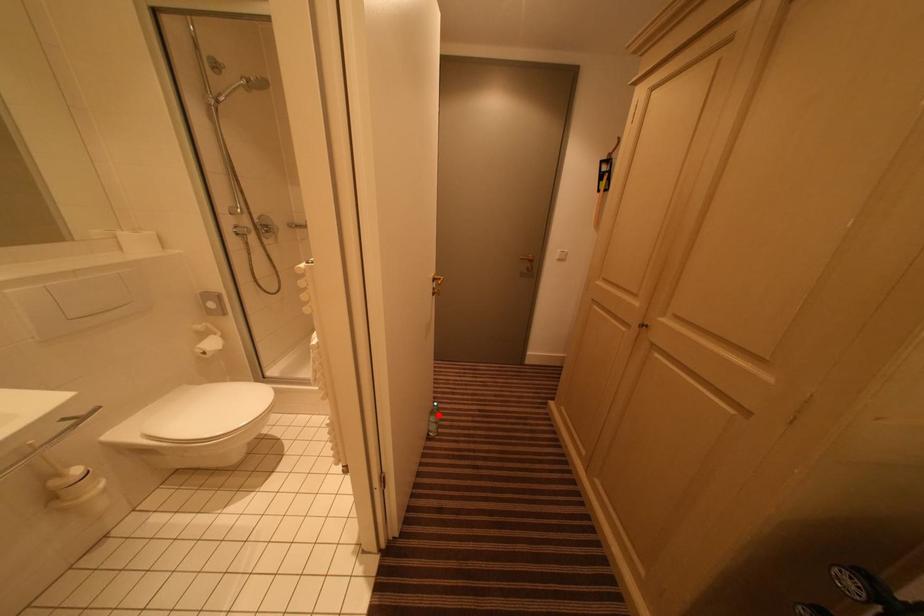
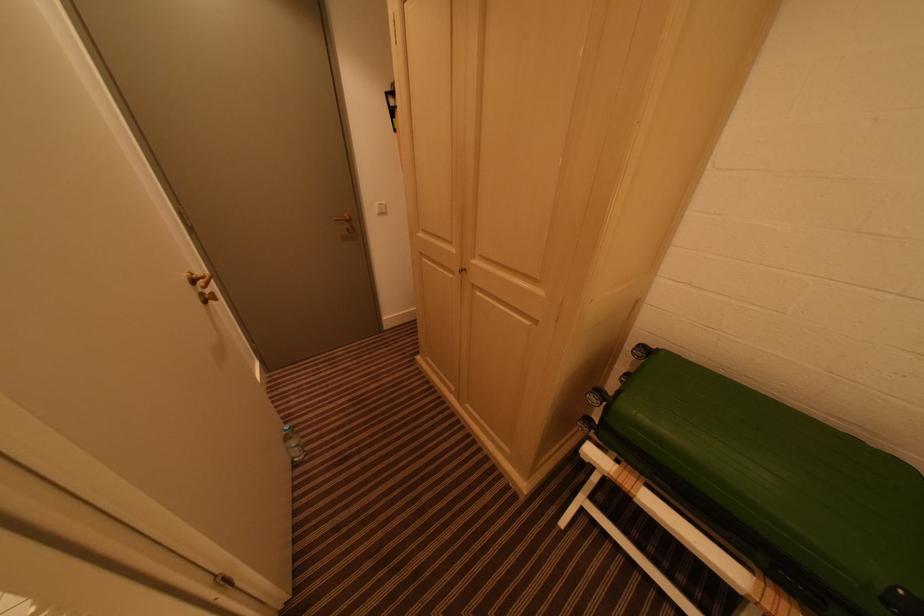
Locate, in the second image, the point that corresponds to the highlighted location in the first image.

(293, 440)